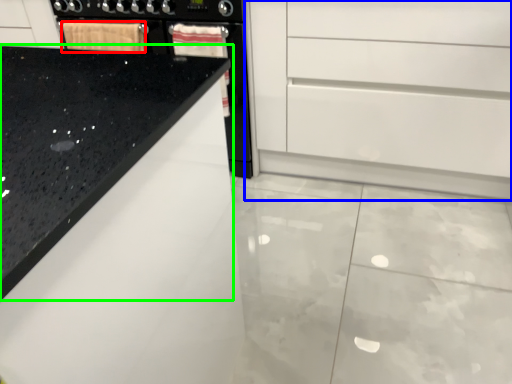
Question: Considering the real-world distances, which object is farthest from material (highlighted by a red box)? chest of drawers (highlighted by a blue box) or countertop (highlighted by a green box)?

Choices:
 (A) chest of drawers
 (B) countertop

Answer: (B)